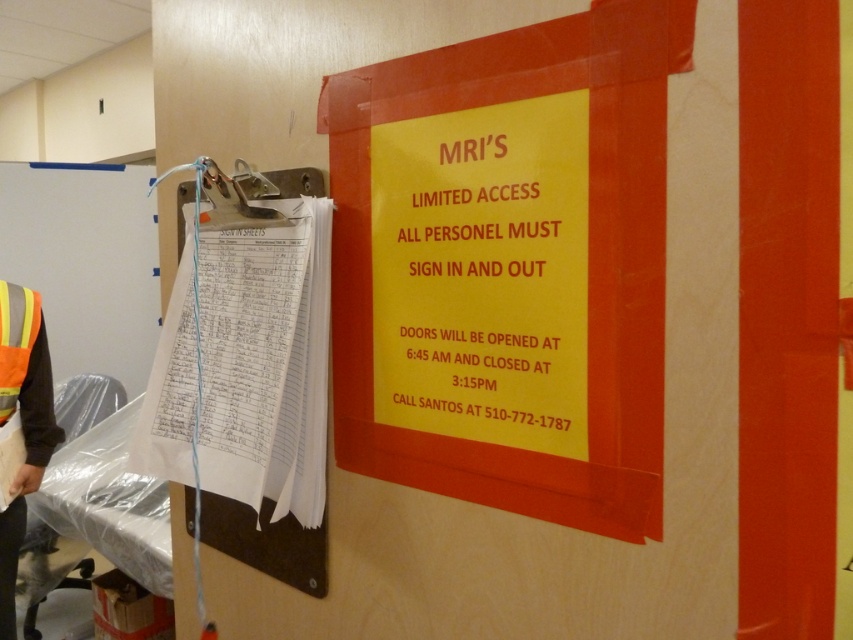
Question: Considering the relative positions of yellow paper sign at upper center and high-visibility fabric safety vest at left in the image provided, where is yellow paper sign at upper center located with respect to high-visibility fabric safety vest at left?

Choices:
 (A) left
 (B) right

Answer: (B)

Question: Which object appears farthest from the camera in this image?

Choices:
 (A) high-visibility fabric safety vest at left
 (B) yellow paper sign at upper center

Answer: (A)

Question: Does yellow paper sign at upper center have a smaller size compared to high-visibility fabric safety vest at left?

Choices:
 (A) yes
 (B) no

Answer: (B)

Question: Which object is closer to the camera taking this photo?

Choices:
 (A) high-visibility fabric safety vest at left
 (B) yellow paper sign at upper center

Answer: (B)

Question: Does yellow paper sign at upper center come in front of high-visibility fabric safety vest at left?

Choices:
 (A) yes
 (B) no

Answer: (A)

Question: Which object is closer to the camera taking this photo?

Choices:
 (A) yellow paper sign at upper center
 (B) high-visibility fabric safety vest at left

Answer: (A)